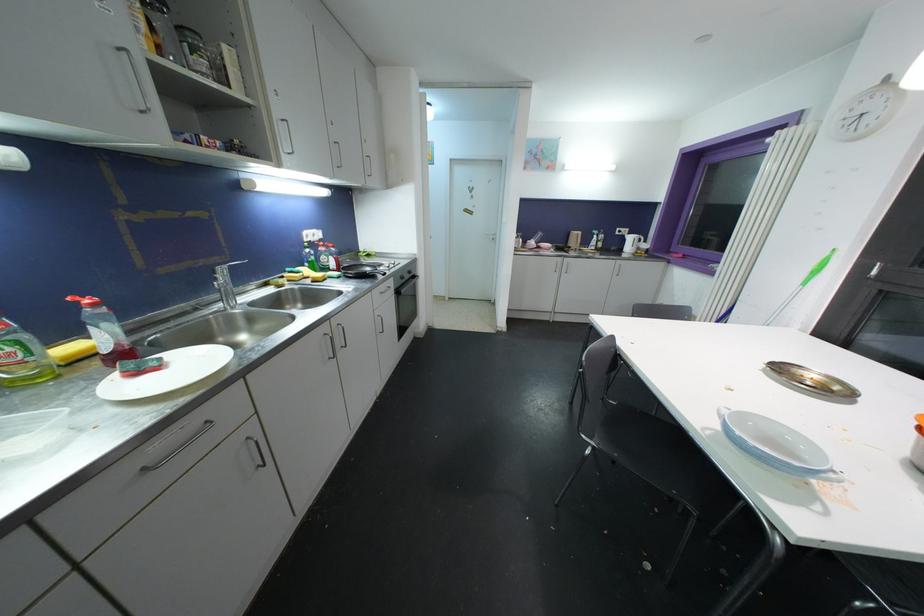
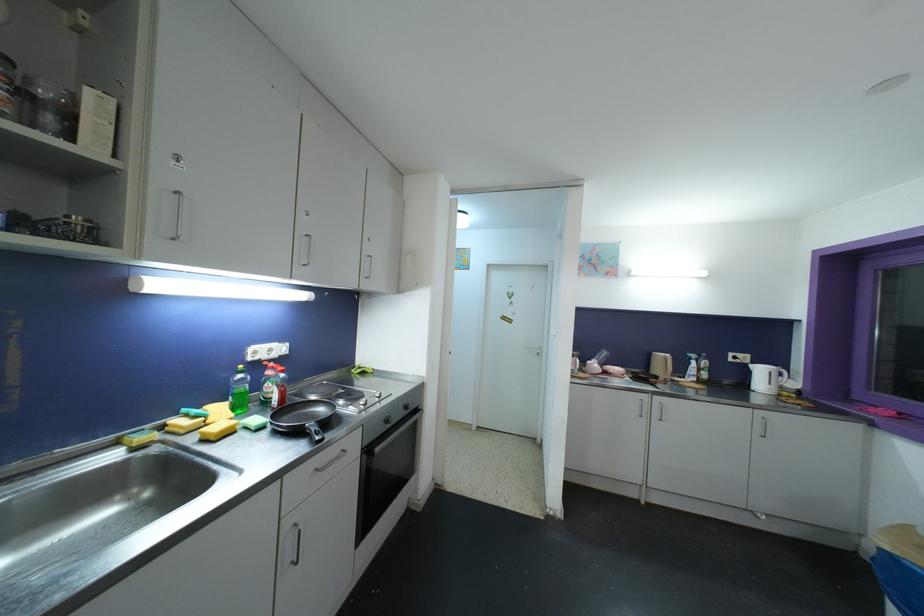
Question: I am providing you with two images of the same scene from different viewpoints. Which of the following objects are not visible in image2?

Choices:
 (A) spray bottle trigger
 (B) kettle handle
 (C) black oven handle
 (D) none of these

Answer: (D)